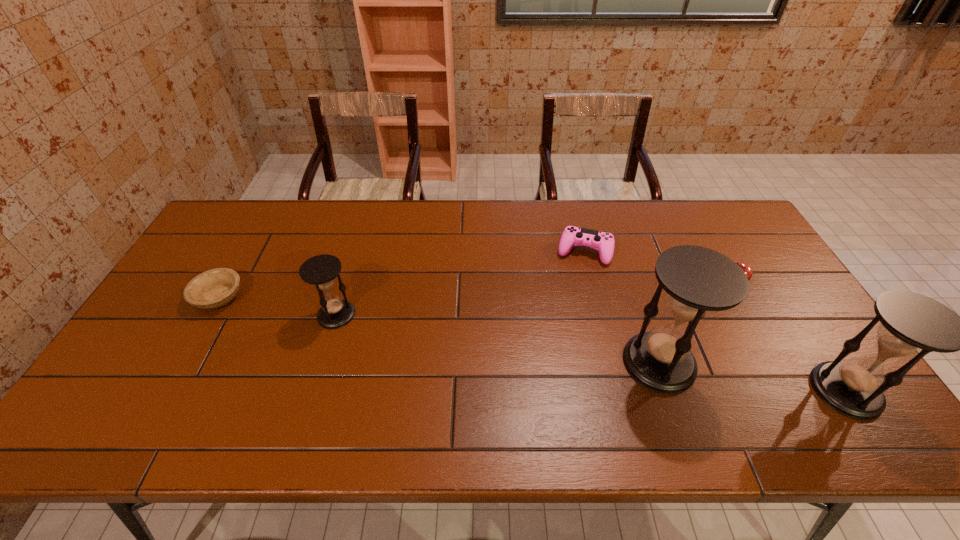
Locate an element on the screen. This screenshot has height=540, width=960. the shortest object is located at coordinates (214, 288).

Where is `vacant space situated on the back of the leftmost hourglass`? The image size is (960, 540). vacant space situated on the back of the leftmost hourglass is located at coordinates (351, 265).

This screenshot has width=960, height=540. Find the location of `vacant space located on the right of the second hourglass from right to left`. vacant space located on the right of the second hourglass from right to left is located at coordinates (726, 363).

I want to click on vacant space located 0.140m on the left of the rightmost hourglass, so click(x=756, y=390).

You are a GUI agent. You are given a task and a screenshot of the screen. Output one action in this format:
    pyautogui.click(x=<x>, y=<y>)
    Task: Click on the free point located 0.130m on the front of the second object from right to left
    The image size is (960, 540).
    Given the screenshot: What is the action you would take?
    pyautogui.click(x=754, y=334)

Identify the location of free space located on the right of the farthest object. (634, 252).

Locate an element on the screen. free space located on the back of the leftmost object is located at coordinates (248, 246).

What are the coordinates of `object at the far edge` in the screenshot? It's located at [603, 242].

The image size is (960, 540). I want to click on object located in the left edge section of the desktop, so click(x=214, y=288).

I want to click on hourglass that is positioned at the right edge, so click(x=912, y=324).